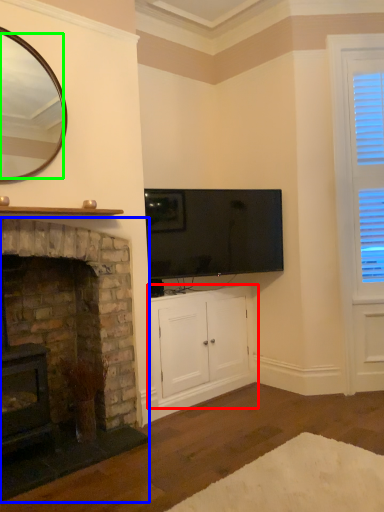
Question: Considering the real-world distances, which object is closest to cabinetry (highlighted by a red box)? fireplace (highlighted by a blue box) or mirror (highlighted by a green box).

Choices:
 (A) fireplace
 (B) mirror

Answer: (A)